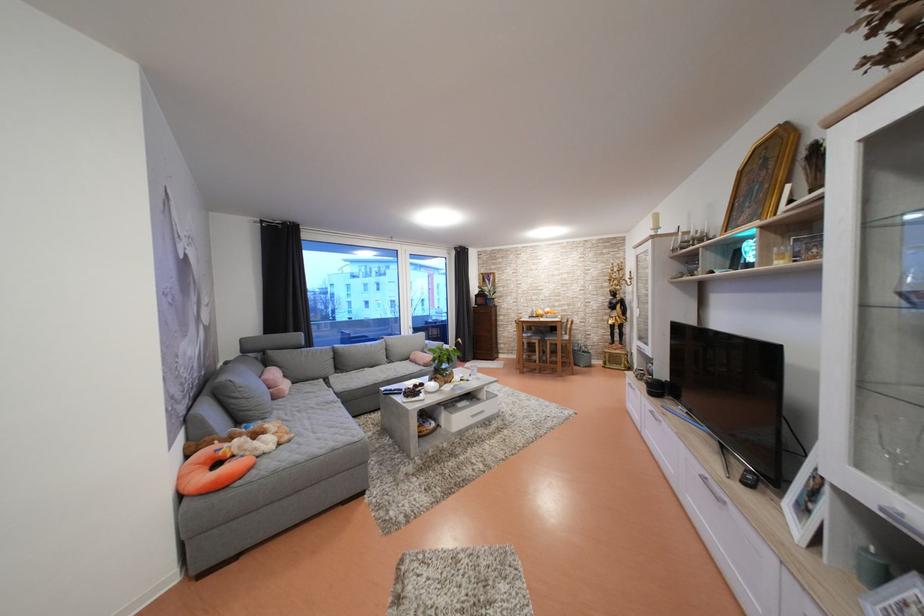
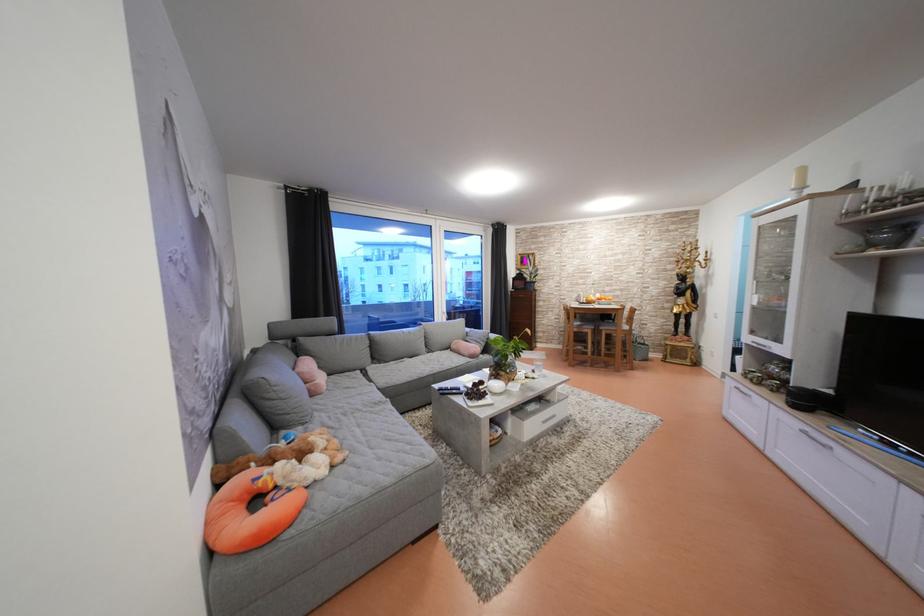
Which direction would the cameraman need to move to produce the second image?

The movement direction of the cameraman is left, forward.